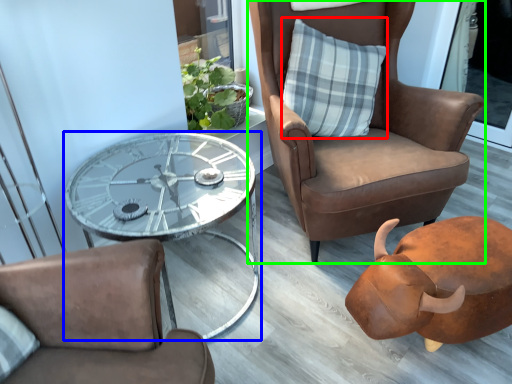
Question: Which object is the closest to the pillow (highlighted by a red box)? Choose among these: coffee table (highlighted by a blue box) or chair (highlighted by a green box).

Choices:
 (A) coffee table
 (B) chair

Answer: (B)